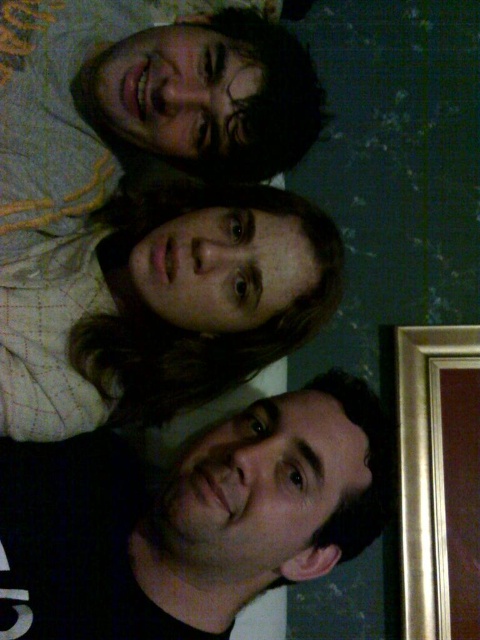
Which is behind, point (194, 468) or point (451, 598)?

The point (451, 598) is more distant.

Does black matte shirt at lower left have a lesser width compared to gold metallic picture frame at right?

No, black matte shirt at lower left is not thinner than gold metallic picture frame at right.

You are a GUI agent. You are given a task and a screenshot of the screen. Output one action in this format:
    pyautogui.click(x=<x>, y=<y>)
    Task: Click on the black matte shirt at lower left
    Image resolution: width=480 pixels, height=640 pixels.
    Given the screenshot: What is the action you would take?
    pyautogui.click(x=190, y=518)

Is black matte shirt at lower left to the left of matte white shirt at center from the viewer's perspective?

In fact, black matte shirt at lower left is to the right of matte white shirt at center.

Does black matte shirt at lower left have a lesser height compared to matte white shirt at center?

Indeed, black matte shirt at lower left has a lesser height compared to matte white shirt at center.

At what (x,y) coordinates should I click in order to perform the action: click on black matte shirt at lower left. Please return your answer as a coordinate pair (x, y). The image size is (480, 640). Looking at the image, I should click on (190, 518).

Who is taller, matte white shirt at center or gold metallic picture frame at right?

gold metallic picture frame at right

Does matte white shirt at center lie behind gold metallic picture frame at right?

That is False.

Does point (247, 358) come closer to viewer compared to point (463, 358)?

That is True.

Where is `matte white shirt at center`? The image size is (480, 640). matte white shirt at center is located at coordinates (163, 307).